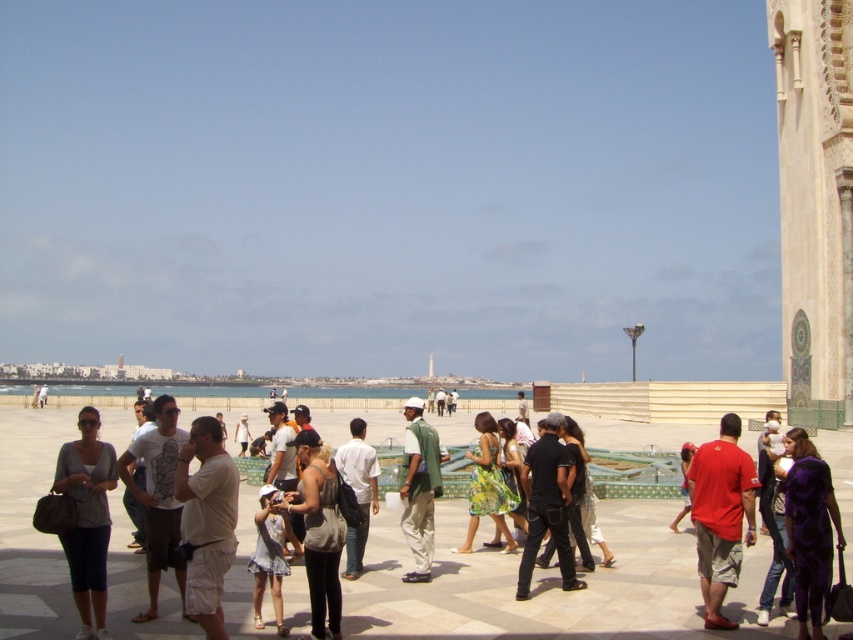
You are a photographer standing in the plaza and want to take a photo of the matte gray shirt at center and the white fabric dress at center. Which of the two should you focus on first if you want to capture both clearly in your shot?

The matte gray shirt at center is much taller than the white fabric dress at center, so you should focus on the matte gray shirt at center first to ensure both are in focus.

You are a photographer positioned at the center of the square. You want to take a photo of the white stone tower at right without any people blocking it. Is the purple satin dress at lower right currently in a position that would block your view of the tower?

The purple satin dress at lower right is behind the white stone tower at right, so it will not block your view of the tower.